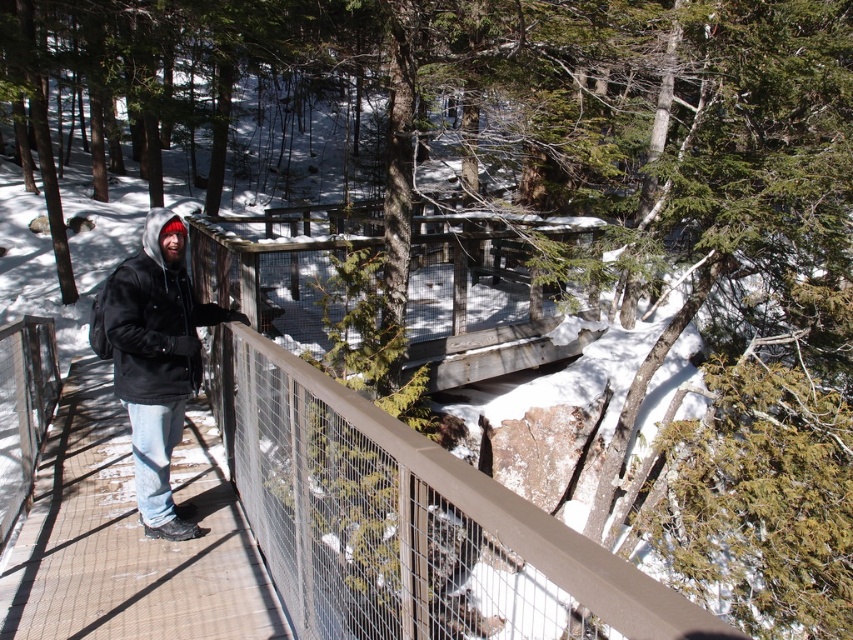
You are standing on the wooden walkway in the winter forest scene. If you want to step onto the wooden planks at center, where should you move relative to your current position?

The wooden planks at center are located at the coordinates point (482, 301), so you should move to that specific point to step onto them.

In the scene shown: You are a photographer trying to capture the wooden planks at center and the black matte jacket at left in the same frame. Based on their heights, which object will appear larger in the photo?

The black matte jacket at left will appear larger in the photo because it has a greater height than the wooden planks at center.

You are standing on the wooden walkway in the winter forest scene. You notice two points marked in the image. Which point, point (x=218, y=284) or point (x=117, y=317), is closer to you?

Point (x=218, y=284) is closer to you because it is further to the viewer than point (x=117, y=317).